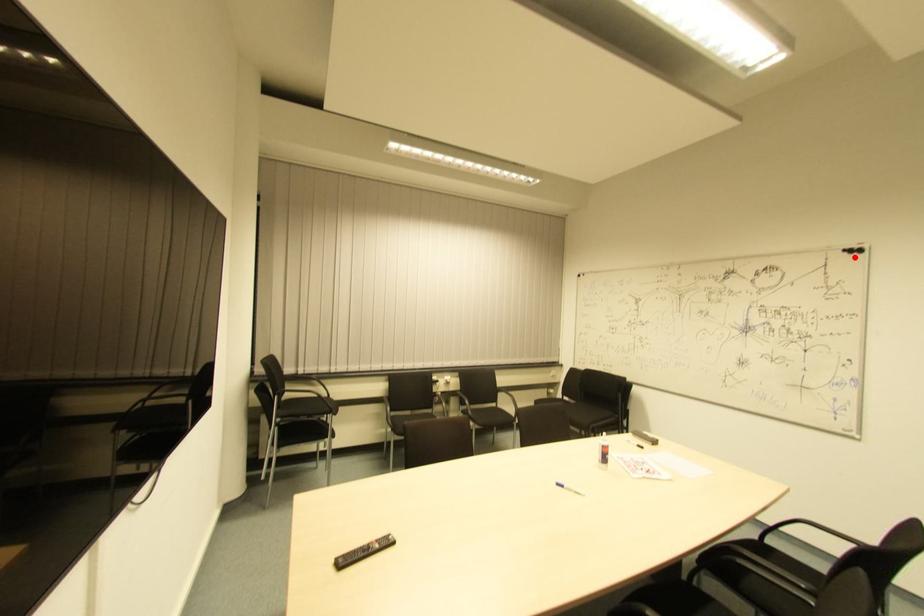
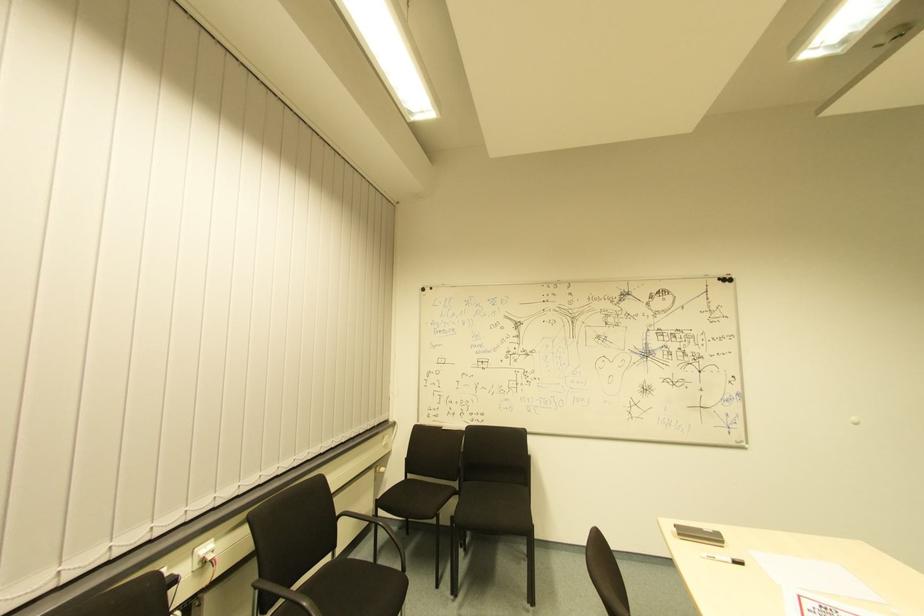
Where in the second image is the point corresponding to the highlighted location from the first image?

(725, 286)